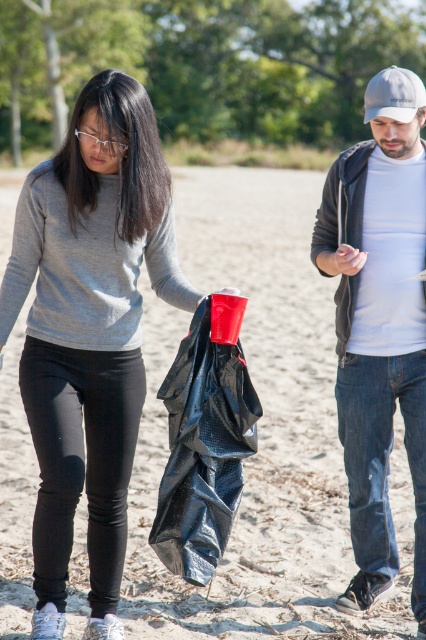
Is black matte bag at center above white fabric baseball cap at upper right?

No, black matte bag at center is not above white fabric baseball cap at upper right.

Which of these two, black matte bag at center or white fabric baseball cap at upper right, stands taller?

With more height is white fabric baseball cap at upper right.

Where is `black matte bag at center`? black matte bag at center is located at coordinates (204, 440).

Is denim jacket at right to the left of black matte bag at center from the viewer's perspective?

No, denim jacket at right is not to the left of black matte bag at center.

Can you confirm if denim jacket at right is bigger than black matte bag at center?

Correct, denim jacket at right is larger in size than black matte bag at center.

Where is `denim jacket at right`? The image size is (426, 640). denim jacket at right is located at coordinates (379, 323).

Who is more distant from viewer, (379, 308) or (394, 112)?

Point (379, 308)

Does denim jacket at right have a lesser width compared to white fabric baseball cap at upper right?

Indeed, denim jacket at right has a lesser width compared to white fabric baseball cap at upper right.

Image resolution: width=426 pixels, height=640 pixels. I want to click on denim jacket at right, so click(379, 323).